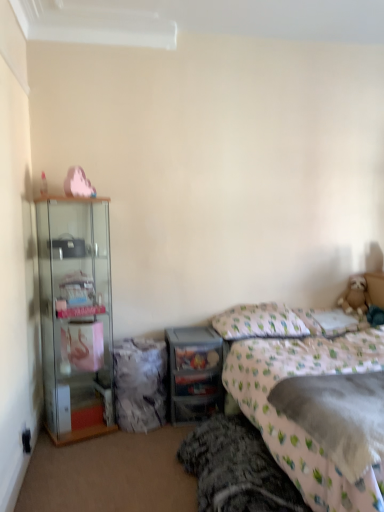
Question: Looking at the image, does fluffy pink blanket at lower right seem bigger or smaller compared to white fabric pillow at center, the second pillow positioned from the right?

Choices:
 (A) big
 (B) small

Answer: (A)

Question: Is fluffy pink blanket at lower right situated inside white fabric pillow at center, the second pillow positioned from the right, or outside?

Choices:
 (A) outside
 (B) inside

Answer: (A)

Question: Which object is the farthest from the clear plastic drawers at center?

Choices:
 (A) fluffy beige teddy bear at right
 (B) clear glass cabinet at left
 (C) white fabric pillow at center, which is counted as the first pillow, starting from the left
 (D) pink fabric bedsheet at lower right
 (E) white fabric pillow at upper right, which is the 1th pillow in right-to-left order

Answer: (A)

Question: Which is nearer to the fluffy gray blanket at lower center?

Choices:
 (A) fluffy pink blanket at lower right
 (B) white fabric pillow at upper right, which is the 1th pillow in right-to-left order
 (C) white fabric pillow at center, which is counted as the first pillow, starting from the left
 (D) fluffy beige teddy bear at right
 (E) clear plastic drawers at center

Answer: (A)